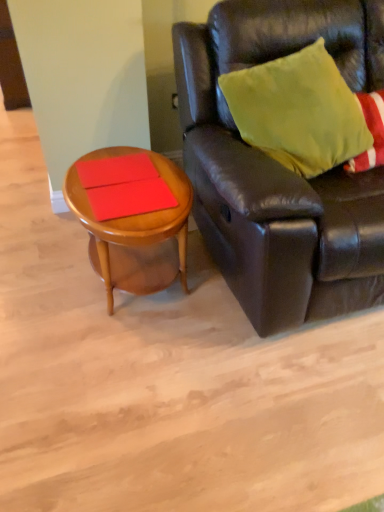
Where is `vacant space in matte red book at left, the first plank viewed from the top (from a real-world perspective)`? This screenshot has width=384, height=512. vacant space in matte red book at left, the first plank viewed from the top (from a real-world perspective) is located at coordinates (107, 172).